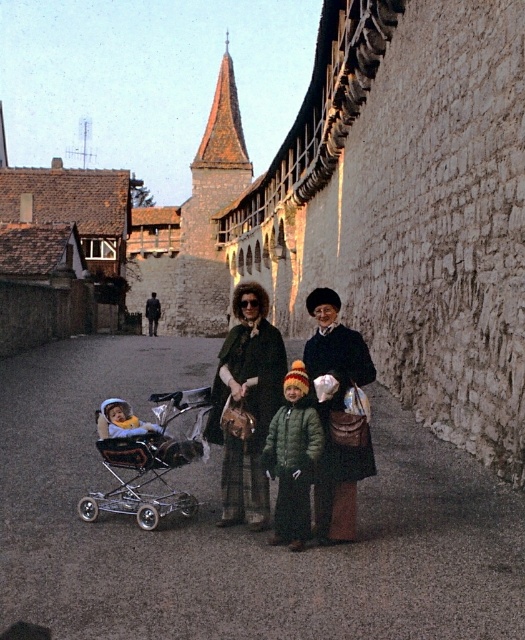
Question: Where is green wool coat at center located in relation to velvet black coat at center in the image?

Choices:
 (A) below
 (B) above

Answer: (B)

Question: Which point is closer to the camera?

Choices:
 (A) soft yellow fabric baby carriage at lower left
 (B) metallic stroller at center-left
 (C) green wool coat at center

Answer: (C)

Question: Which point is closer to the camera?

Choices:
 (A) (110, 493)
 (B) (117, 435)
 (C) (345, 452)
 (D) (176, 365)

Answer: (C)

Question: Which point is closer to the camera?

Choices:
 (A) (303, 524)
 (B) (148, 520)
 (C) (191, 580)

Answer: (C)

Question: In this image, where is green woolen coat at center located relative to green fuzzy coat at center?

Choices:
 (A) left
 (B) right

Answer: (A)

Question: Does dark gray asphalt at center appear on the left side of velvet black coat at center?

Choices:
 (A) no
 (B) yes

Answer: (B)